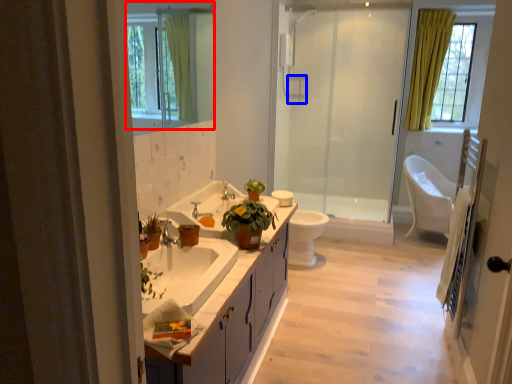
Question: Which point is closer to the camera, mirror (highlighted by a red box) or towel bar (highlighted by a blue box)?

Choices:
 (A) mirror
 (B) towel bar

Answer: (A)